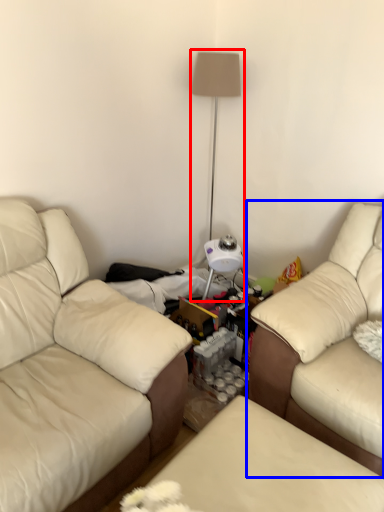
Question: Among these objects, which one is farthest to the camera, table lamp (highlighted by a red box) or studio couch (highlighted by a blue box)?

Choices:
 (A) table lamp
 (B) studio couch

Answer: (A)